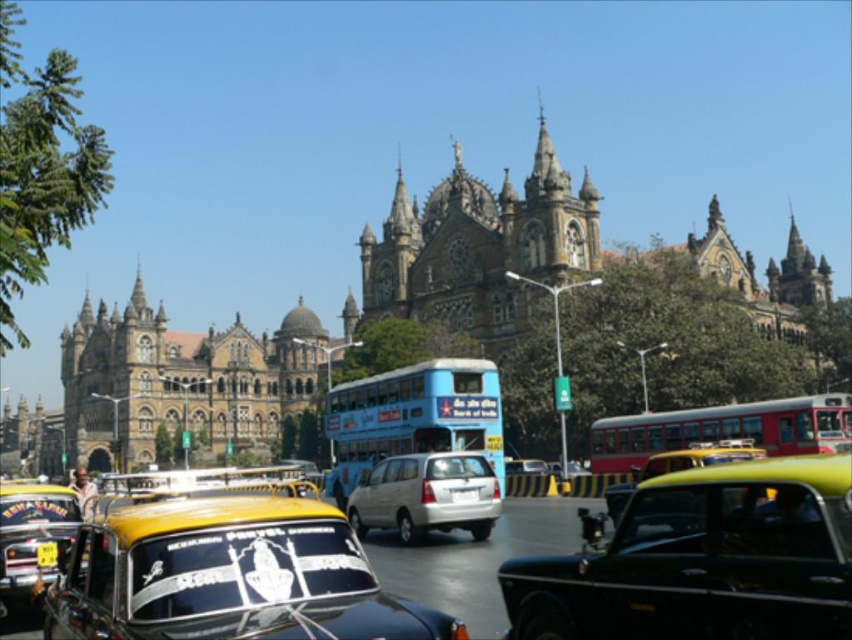
You are standing on the street in front of the grand building and want to reach the point marked by point (x=724, y=429). There is an obstacle at point (x=372, y=508). Can you walk directly to your destination without going around the obstacle?

Point (x=724, y=429) is behind point (x=372, y=508), so you cannot walk directly to point (x=724, y=429) without going around the obstacle at point (x=372, y=508).

You are a pedestrian standing on the sidewalk and want to cross the street to reach the grand ornate building in the background. Which vehicle, the black glossy taxi at center or the blue painted metal decker bus at center, is closer to you as you prepare to cross?

The black glossy taxi at center is closer to the viewer than the blue painted metal decker bus at center, so the taxi is closer to you as you prepare to cross the street.

You are a pedestrian standing on the sidewalk and want to cross the street to reach the grand ornate building in the background. The yellow matte taxi cab at center and the blue painted metal decker bus at center are blocking your path. Which vehicle should you move around first to reach the building?

The yellow matte taxi cab at center is below the blue painted metal decker bus at center, so you should move around the yellow matte taxi cab at center first since it is closer to you on the ground level.